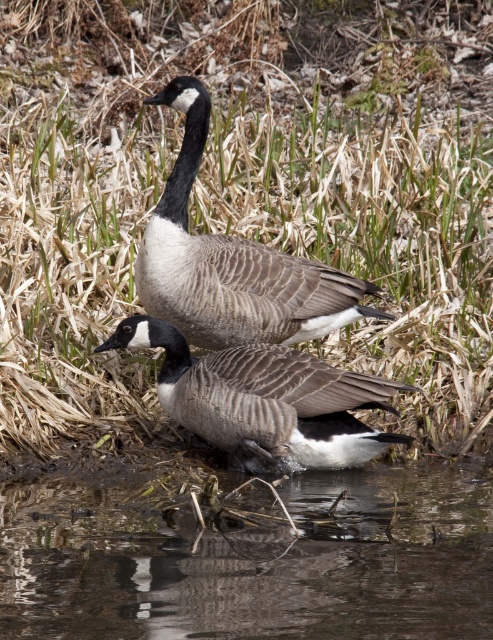
Question: From the image, what is the correct spatial relationship of brown murky water at lower center in relation to gray matte goose at center?

Choices:
 (A) left
 (B) right

Answer: (B)

Question: Is brown dry grass at center bigger than brown textured duck at center?

Choices:
 (A) no
 (B) yes

Answer: (B)

Question: Can you confirm if brown murky water at lower center is positioned below gray matte goose at center?

Choices:
 (A) yes
 (B) no

Answer: (A)

Question: Which of the following is the closest to the observer?

Choices:
 (A) (16, 168)
 (B) (491, 620)

Answer: (B)

Question: Based on their relative distances, which object is nearer to the brown murky water at lower center?

Choices:
 (A) brown dry grass at center
 (B) brown textured duck at center
 (C) gray matte goose at center

Answer: (B)

Question: Which object is positioned closest to the gray matte goose at center?

Choices:
 (A) brown textured duck at center
 (B) brown dry grass at center
 (C) brown murky water at lower center

Answer: (A)